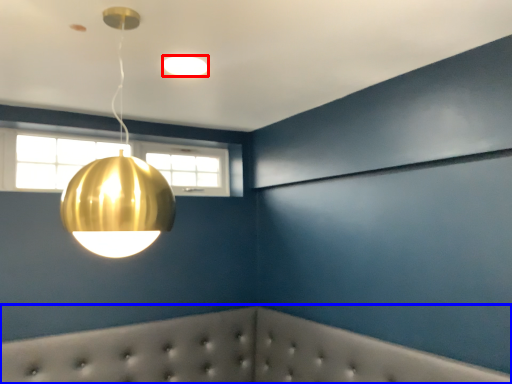
Question: Which object is further to the camera taking this photo, lamp (highlighted by a red box) or furniture (highlighted by a blue box)?

Choices:
 (A) lamp
 (B) furniture

Answer: (A)